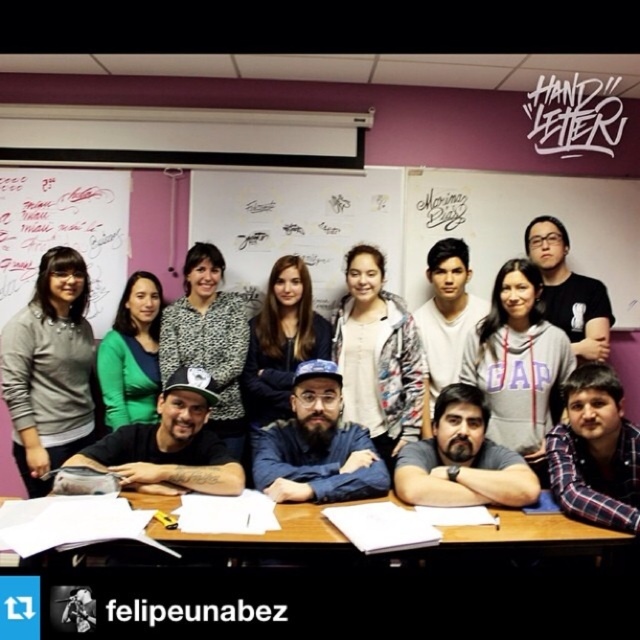
You are a student who just entered the classroom and need to find the wooden table at center. Where should you look relative to the whiteboard at upper left?

The wooden table at center is located below the whiteboard at upper left, so you should look downward from the whiteboard at upper left to find it.